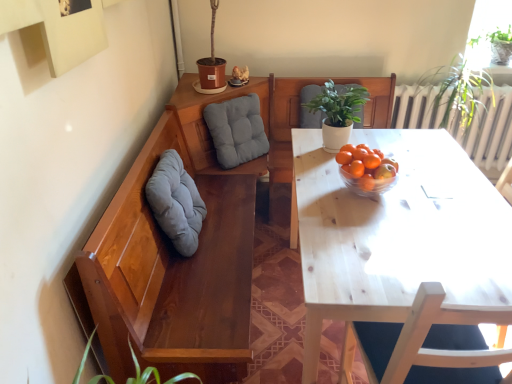
Question: Is transparent glass window at upper right to the left of soft gray cushion at left, the second gray when ordered from back to front, from the viewer's perspective?

Choices:
 (A) no
 (B) yes

Answer: (A)

Question: Does transparent glass window at upper right have a lesser height compared to soft gray cushion at left, the first gray from the front?

Choices:
 (A) no
 (B) yes

Answer: (B)

Question: Can you confirm if transparent glass window at upper right is smaller than soft gray cushion at left, the second gray when ordered from back to front?

Choices:
 (A) yes
 (B) no

Answer: (A)

Question: Is transparent glass window at upper right wider than soft gray cushion at left, the first gray from the front?

Choices:
 (A) yes
 (B) no

Answer: (A)

Question: Does transparent glass window at upper right appear on the right side of soft gray cushion at left, the second gray when ordered from back to front?

Choices:
 (A) yes
 (B) no

Answer: (A)

Question: Is soft gray cushion at left, the first gray from the front, at the back of transparent glass window at upper right?

Choices:
 (A) no
 (B) yes

Answer: (A)

Question: Would you say matte gray cushion at center, which is counted as the 1th gray, starting from the back, is outside transparent glass window at upper right?

Choices:
 (A) no
 (B) yes

Answer: (B)

Question: From the image's perspective, is matte gray cushion at center, which is counted as the 1th gray, starting from the back, below transparent glass window at upper right?

Choices:
 (A) no
 (B) yes

Answer: (B)

Question: Is matte gray cushion at center, the 2th gray positioned from the front, aimed at transparent glass window at upper right?

Choices:
 (A) yes
 (B) no

Answer: (B)

Question: Is matte gray cushion at center, which is counted as the 1th gray, starting from the back, facing away from transparent glass window at upper right?

Choices:
 (A) no
 (B) yes

Answer: (A)

Question: Does matte gray cushion at center, which is counted as the 1th gray, starting from the back, have a lesser width compared to transparent glass window at upper right?

Choices:
 (A) no
 (B) yes

Answer: (B)

Question: Is matte gray cushion at center, which is counted as the 1th gray, starting from the back, placed right next to transparent glass window at upper right?

Choices:
 (A) no
 (B) yes

Answer: (A)

Question: From the image's perspective, is green matte plant at upper center on soft gray cushion at left, the first gray from the front?

Choices:
 (A) no
 (B) yes

Answer: (B)